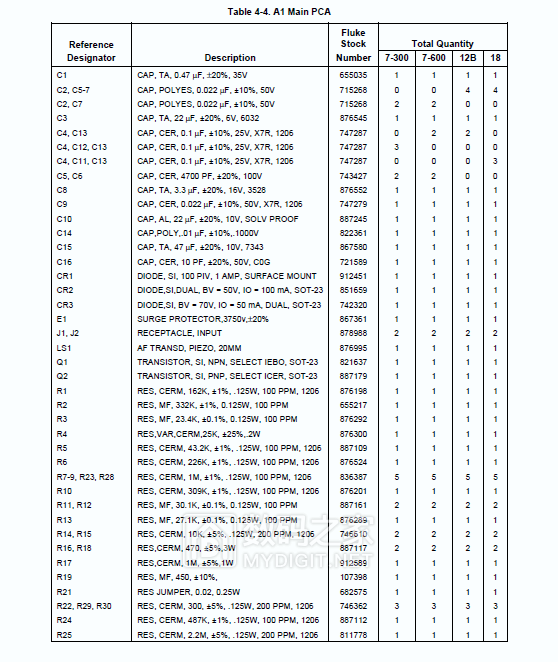
This screenshot has width=558, height=662. I want to click on columns, so click(86, 79), click(204, 89), click(335, 85), click(393, 89), click(427, 91), click(464, 93), click(495, 93).